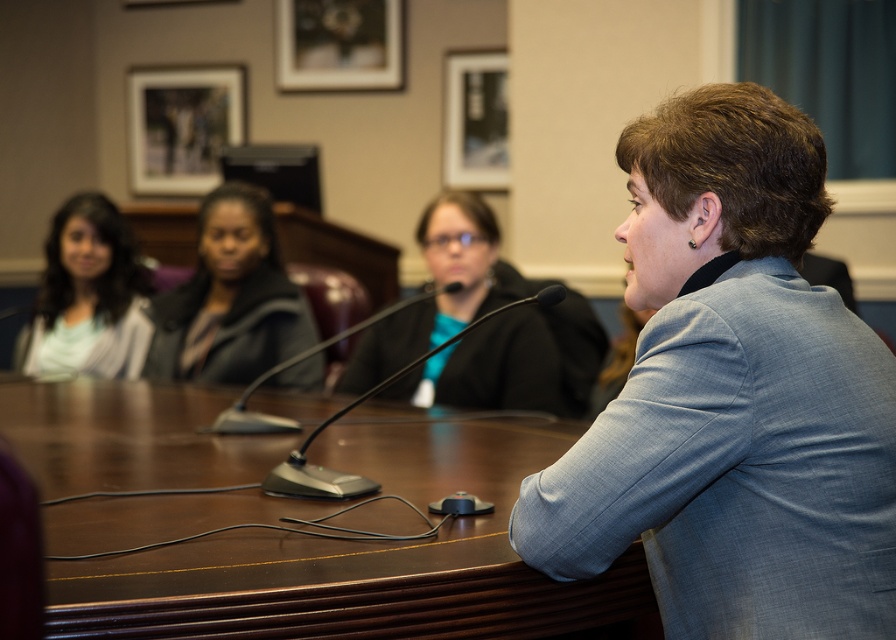
Who is shorter, brown wood table at center or light blue shirt at left?

With less height is brown wood table at center.

Is brown wood table at center bigger than light blue shirt at left?

Yes, brown wood table at center is bigger than light blue shirt at left.

You are a GUI agent. You are given a task and a screenshot of the screen. Output one action in this format:
    pyautogui.click(x=<x>, y=<y>)
    Task: Click on the brown wood table at center
    
    Given the screenshot: What is the action you would take?
    pyautogui.click(x=363, y=554)

At what (x,y) coordinates should I click in order to perform the action: click on brown wood table at center. Please return your answer as a coordinate pair (x, y). This screenshot has width=896, height=640. Looking at the image, I should click on (363, 554).

The image size is (896, 640). What do you see at coordinates (519, 362) in the screenshot?
I see `blue fabric jacket at center` at bounding box center [519, 362].

Does blue fabric jacket at center appear under matte black jacket at center?

Yes, blue fabric jacket at center is below matte black jacket at center.

What do you see at coordinates (519, 362) in the screenshot?
I see `blue fabric jacket at center` at bounding box center [519, 362].

In order to click on blue fabric jacket at center in this screenshot , I will do `click(519, 362)`.

From the picture: Does blue textured blazer at center come in front of light blue shirt at left?

Yes, blue textured blazer at center is closer to the viewer.

Does blue textured blazer at center appear over light blue shirt at left?

No, blue textured blazer at center is not above light blue shirt at left.

Who is more distant from viewer, [785,300] or [49,330]?

Point [49,330]

I want to click on blue textured blazer at center, so click(x=731, y=396).